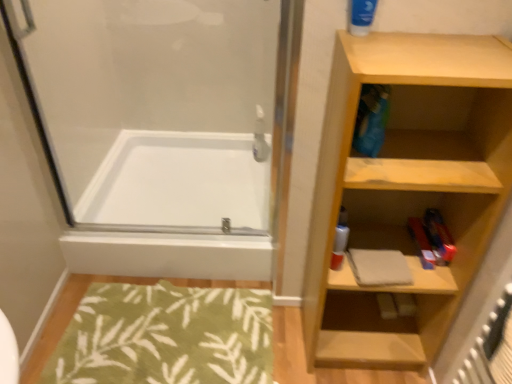
Question: From a real-world perspective, is transparent glass shower door at upper left on blue matte tube at upper right?

Choices:
 (A) yes
 (B) no

Answer: (B)

Question: Is the depth of transparent glass shower door at upper left greater than that of blue matte tube at upper right?

Choices:
 (A) no
 (B) yes

Answer: (B)

Question: From the image's perspective, is transparent glass shower door at upper left on blue matte tube at upper right?

Choices:
 (A) no
 (B) yes

Answer: (A)

Question: Is transparent glass shower door at upper left next to blue matte tube at upper right?

Choices:
 (A) no
 (B) yes

Answer: (A)

Question: Considering the relative positions of transparent glass shower door at upper left and blue matte tube at upper right in the image provided, is transparent glass shower door at upper left to the left of blue matte tube at upper right from the viewer's perspective?

Choices:
 (A) no
 (B) yes

Answer: (B)

Question: Is there a large distance between transparent glass shower door at upper left and blue matte tube at upper right?

Choices:
 (A) yes
 (B) no

Answer: (A)

Question: Does white glossy bathtub at center have a smaller size compared to transparent glass shower door at upper left?

Choices:
 (A) yes
 (B) no

Answer: (B)

Question: Is the position of white glossy bathtub at center more distant than that of transparent glass shower door at upper left?

Choices:
 (A) yes
 (B) no

Answer: (A)

Question: Is white glossy bathtub at center facing away from transparent glass shower door at upper left?

Choices:
 (A) yes
 (B) no

Answer: (B)

Question: Is white glossy bathtub at center at the right side of transparent glass shower door at upper left?

Choices:
 (A) yes
 (B) no

Answer: (A)

Question: Considering the relative sizes of white glossy bathtub at center and transparent glass shower door at upper left in the image provided, is white glossy bathtub at center thinner than transparent glass shower door at upper left?

Choices:
 (A) yes
 (B) no

Answer: (B)

Question: From the image's perspective, is white glossy bathtub at center over transparent glass shower door at upper left?

Choices:
 (A) yes
 (B) no

Answer: (B)

Question: Is the position of blue matte tube at upper right less distant than that of green leafy rug at lower left?

Choices:
 (A) yes
 (B) no

Answer: (A)